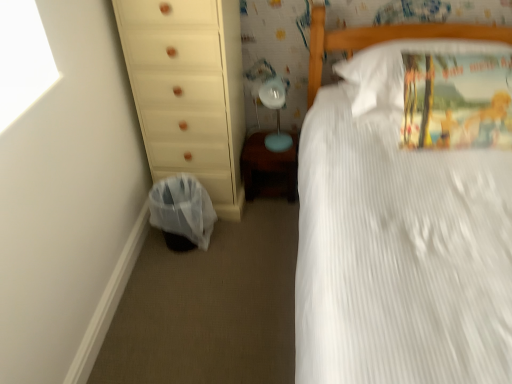
In order to click on empty space that is ontop of wooden changing table at lower center (from a real-world perspective) in this screenshot , I will do `click(264, 142)`.